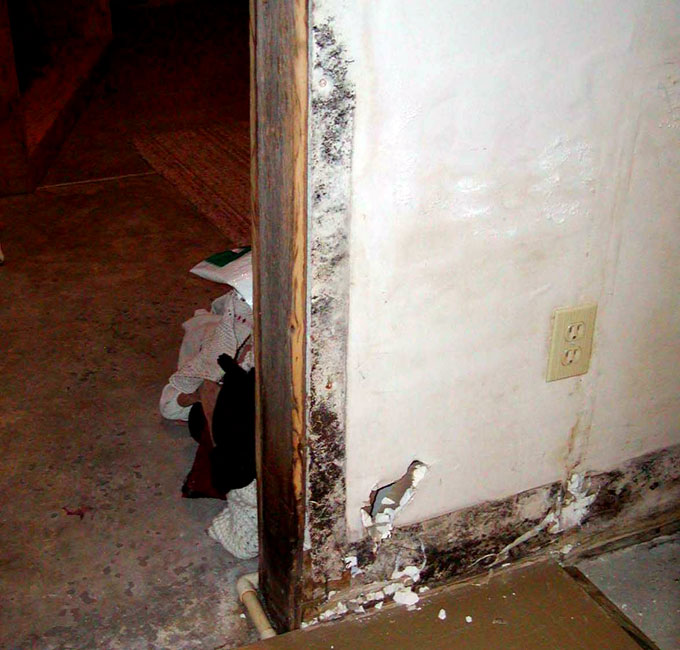
Image resolution: width=680 pixels, height=650 pixels. In order to click on piping, plumbing type pipes in this screenshot , I will do `click(251, 603)`.